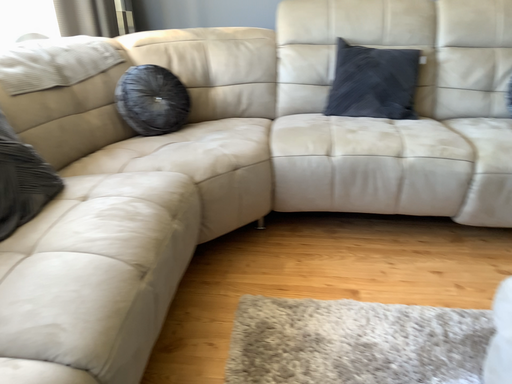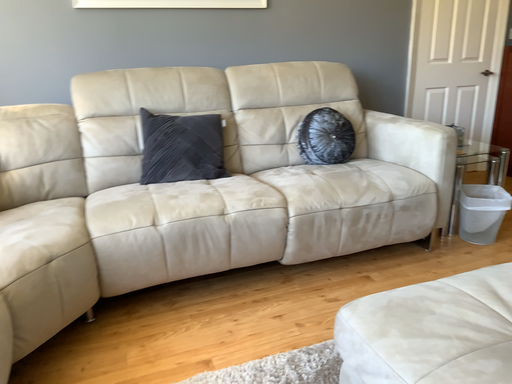
Question: How did the camera likely rotate when shooting the video?

Choices:
 (A) rotated upward
 (B) rotated downward

Answer: (A)